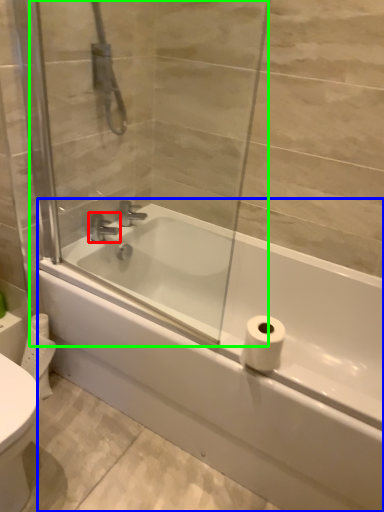
Question: Considering the real-world distances, which object is closest to tap (highlighted by a red box)? bathtub (highlighted by a blue box) or screen door (highlighted by a green box).

Choices:
 (A) bathtub
 (B) screen door

Answer: (B)